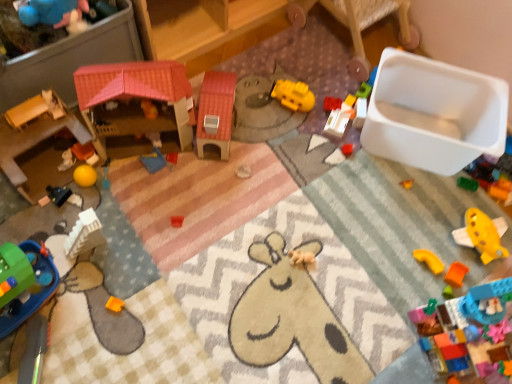
Identify the location of free area in between bright red plastic blocks at center, which ranks as the ninth toy in left-to-right order, and yellow plastic airplane at lower right, arranged as the 15th toy when viewed from the left. The height and width of the screenshot is (384, 512). (413, 191).